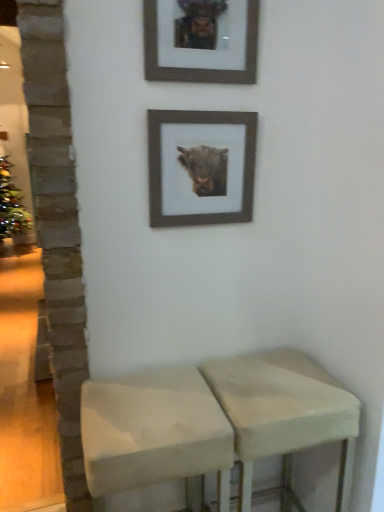
Question: Considering the positions of beige fabric stool at lower center, the second stool from the left, and wooden picture frame at upper center, acting as the first picture frame starting from the top, in the image, is beige fabric stool at lower center, the second stool from the left, wider or thinner than wooden picture frame at upper center, acting as the first picture frame starting from the top,?

Choices:
 (A) thin
 (B) wide

Answer: (B)

Question: Would you say beige fabric stool at lower center, which appears as the first stool when viewed from the right, is inside or outside wooden picture frame at upper center, acting as the first picture frame starting from the top?

Choices:
 (A) outside
 (B) inside

Answer: (A)

Question: Estimate the real-world distances between objects in this image. Which object is closer to the beige fabric stool at lower center, the second stool from the left?

Choices:
 (A) wooden picture frame at upper center, positioned as the second picture frame in bottom-to-top order
 (B) white fabric stool at center, which ranks as the 1th stool in left-to-right order
 (C) wooden frame at upper center, placed as the 1th picture frame when sorted from bottom to top

Answer: (B)

Question: Which of these objects is positioned closest to the wooden picture frame at upper center, acting as the first picture frame starting from the top?

Choices:
 (A) beige fabric stool at lower center, which appears as the first stool when viewed from the right
 (B) white fabric stool at center, positioned as the second stool in right-to-left order
 (C) wooden frame at upper center, positioned as the second picture frame in top-to-bottom order

Answer: (C)